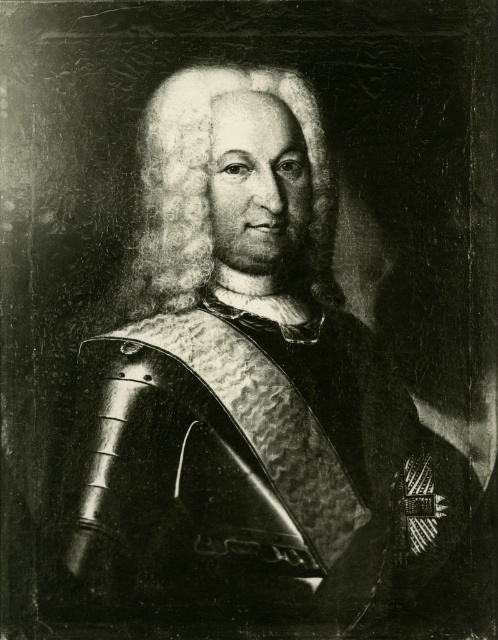
Question: Which point appears farthest from the camera in this image?

Choices:
 (A) (280, 262)
 (B) (287, 72)

Answer: (A)

Question: Can you confirm if white textured hair at center is positioned to the left of white fluffy beard at center?

Choices:
 (A) yes
 (B) no

Answer: (A)

Question: Is white textured hair at center wider than white fluffy beard at center?

Choices:
 (A) yes
 (B) no

Answer: (A)

Question: Is white textured hair at center closer to camera compared to white fluffy beard at center?

Choices:
 (A) no
 (B) yes

Answer: (B)